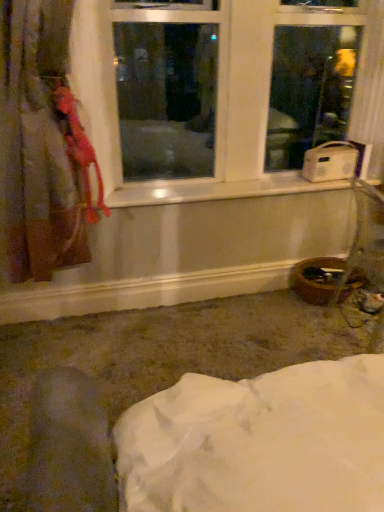
Question: Is velvet-like pink curtain at left spatially inside white plastic radio at right, or outside of it?

Choices:
 (A) outside
 (B) inside

Answer: (A)

Question: Is velvet-like pink curtain at left wider or thinner than white plastic radio at right?

Choices:
 (A) thin
 (B) wide

Answer: (B)

Question: Estimate the real-world distances between objects in this image. Which object is closer to the white plastic window at upper center?

Choices:
 (A) white plastic radio at right
 (B) white plastic window sill at center
 (C) velvet-like pink curtain at left

Answer: (B)

Question: Considering the real-world distances, which object is closest to the white plastic window sill at center?

Choices:
 (A) velvet-like pink curtain at left
 (B) white plastic window at upper center
 (C) white plastic radio at right

Answer: (B)